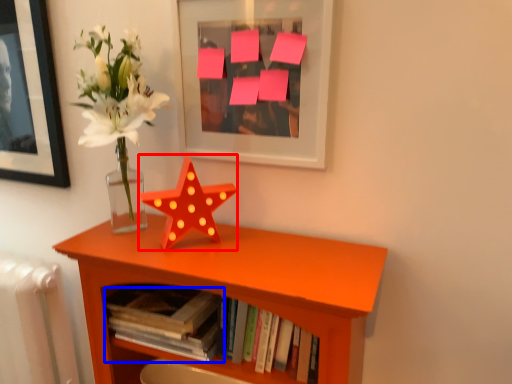
Question: Among these objects, which one is nearest to the camera, flower (highlighted by a red box) or book (highlighted by a blue box)?

Choices:
 (A) flower
 (B) book

Answer: (A)